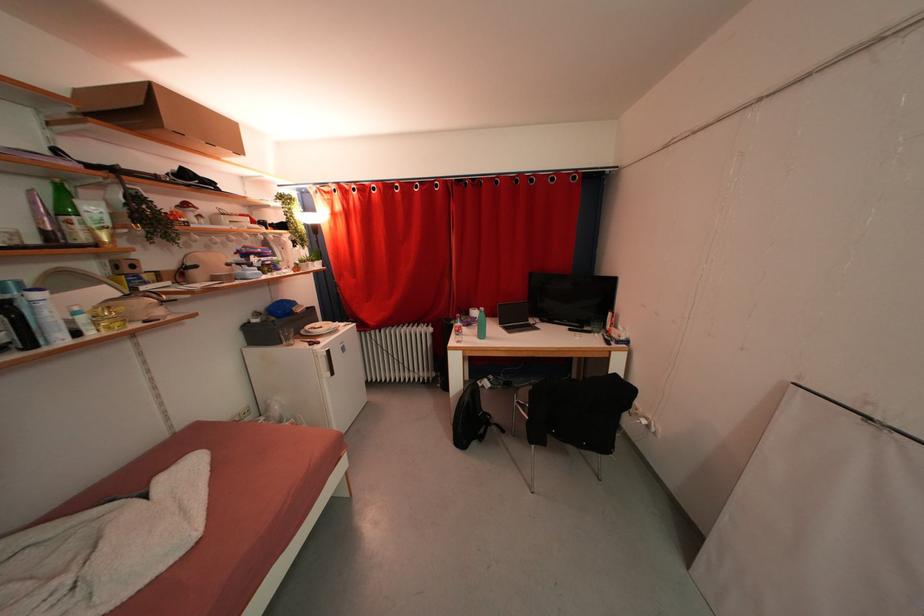
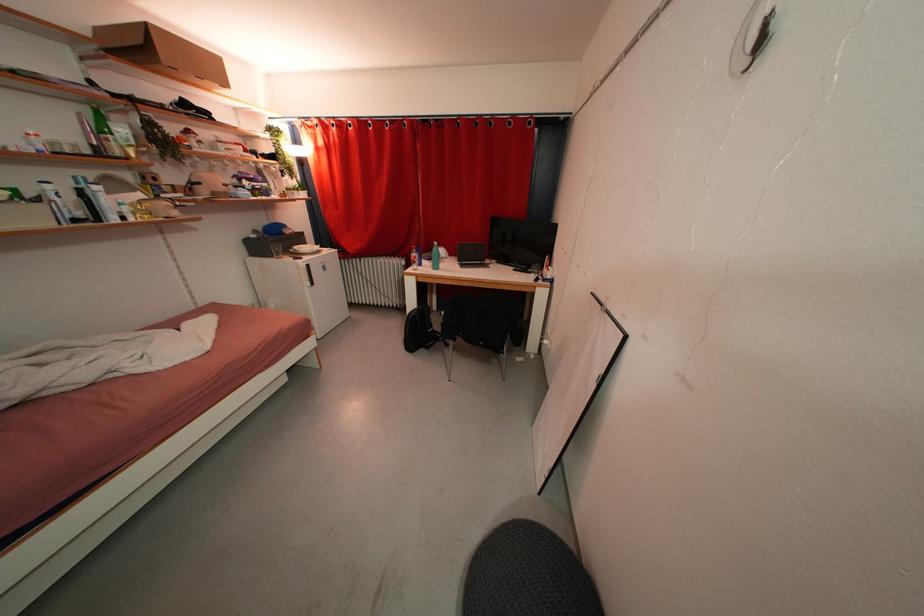
Locate, in the second image, the point that corresponds to (473,329) in the first image.

(435, 262)